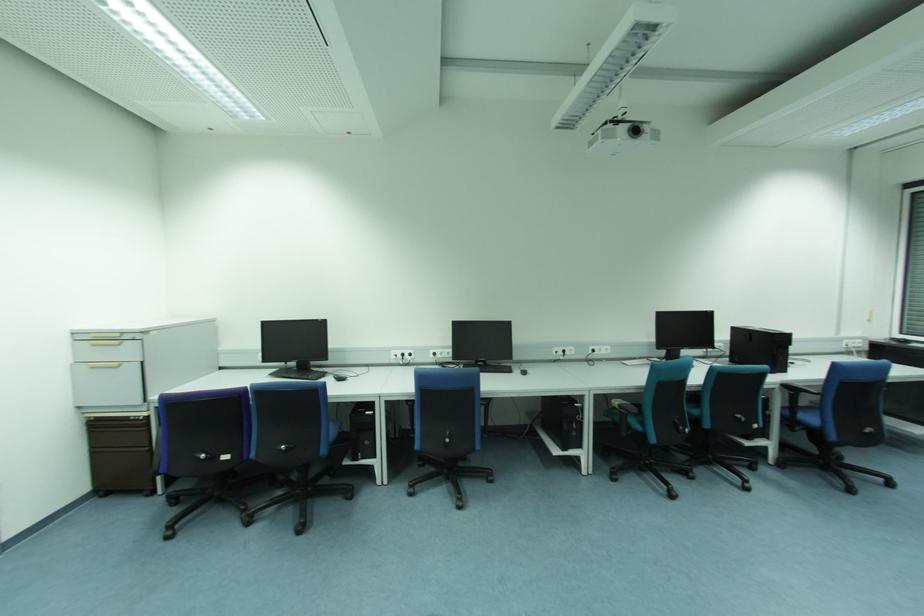
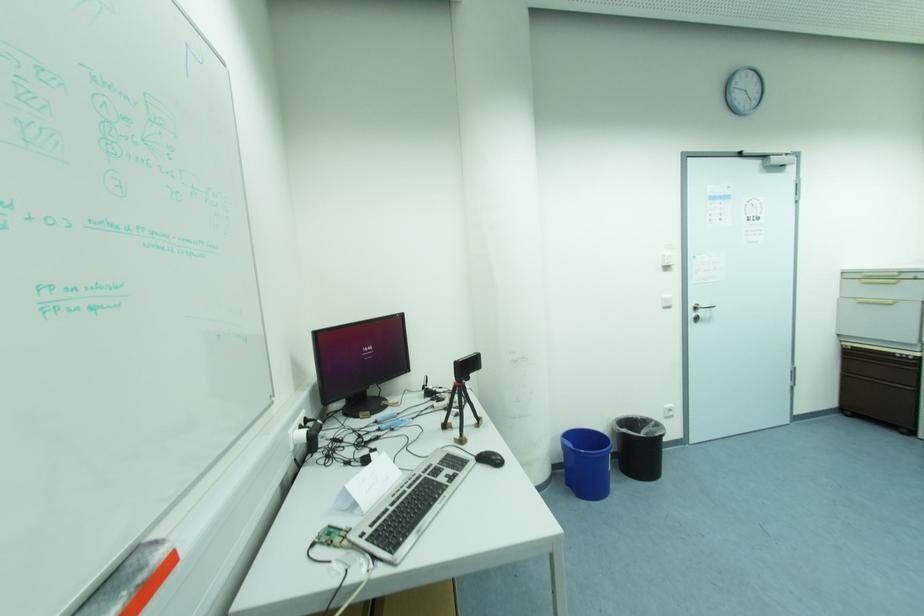
Where in the second image is the point corresponding to point (93, 369) from the first image?

(862, 304)